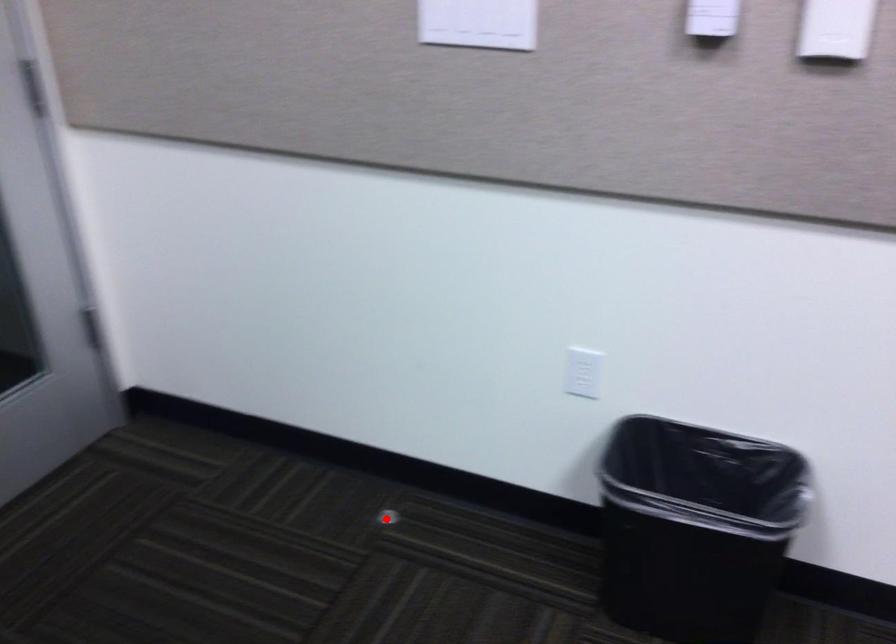
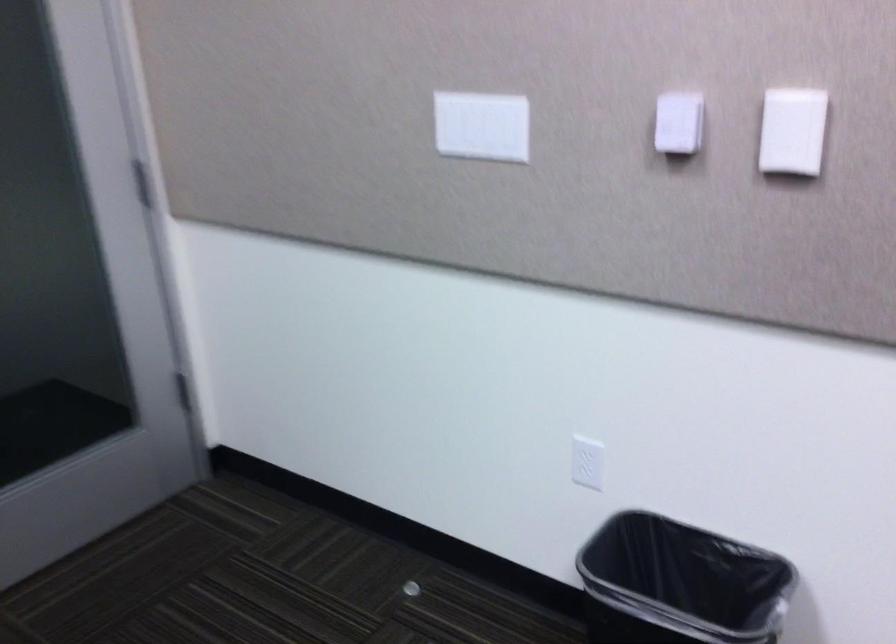
Question: I am providing you with two images of the same scene from different viewpoints. A red point is marked on the first image. Can you still see the location of the red point in image 2?

Choices:
 (A) Yes
 (B) No

Answer: (A)